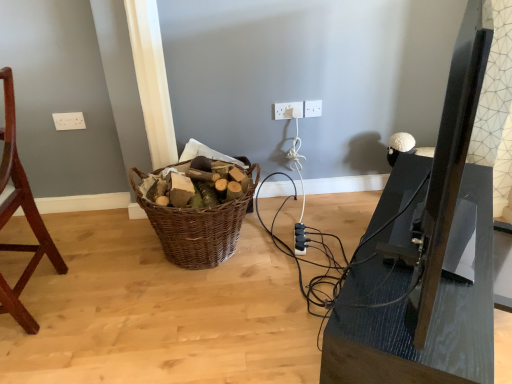
Question: Is point (161, 231) positioned closer to the camera than point (481, 306)?

Choices:
 (A) closer
 (B) farther

Answer: (B)

Question: Would you say woven brown basket at center is inside or outside matte black tv stand at right?

Choices:
 (A) outside
 (B) inside

Answer: (A)

Question: Which object is the closest to the matte black tv stand at right?

Choices:
 (A) white plastic electric outlet at upper center, which is the third electric outlet in right-to-left order
 (B) white plastic electric outlet at center, arranged as the 2th electric outlet when viewed from the right
 (C) white plastic electric outlet at upper center, placed as the first electric outlet when sorted from right to left
 (D) black plastic extension cord at lower center
 (E) mahogany wood chair at left

Answer: (D)

Question: Which of these objects is positioned closest to the mahogany wood chair at left?

Choices:
 (A) white plastic electric outlet at center, arranged as the 2th electric outlet when viewed from the right
 (B) black plastic extension cord at lower center
 (C) white plastic electric outlet at upper center, placed as the first electric outlet when sorted from right to left
 (D) matte black tv stand at right
 (E) woven brown basket at center

Answer: (E)